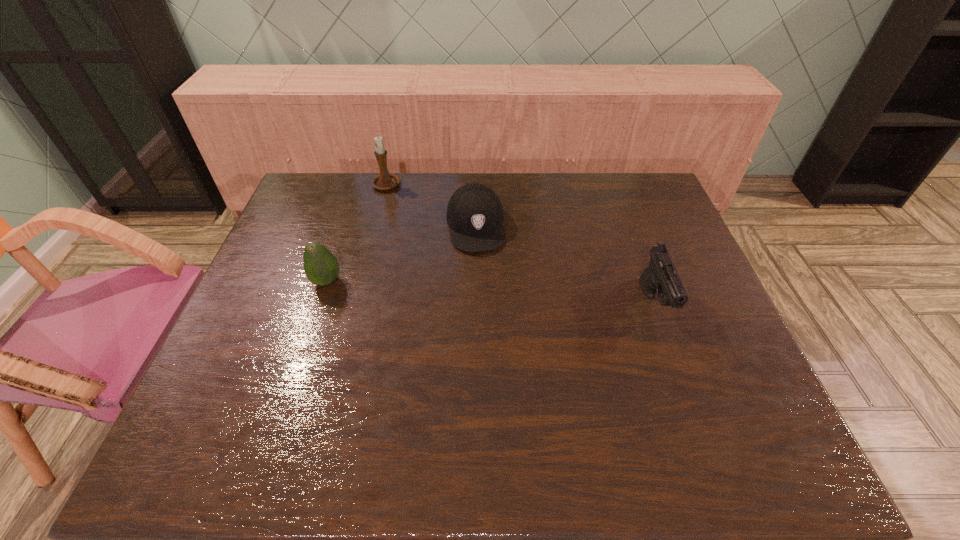
Locate an element on the screen. Image resolution: width=960 pixels, height=540 pixels. vacant space located on the front-facing side of the second object from right to left is located at coordinates (487, 314).

Identify the location of vacant point located 0.340m on the side of the candle holder with the handle. This screenshot has height=540, width=960. (431, 255).

Locate an element on the screen. vacant point located 0.250m on the side of the candle holder with the handle is located at coordinates (420, 238).

Image resolution: width=960 pixels, height=540 pixels. Find the location of `free point located on the side of the candle holder with the handle`. free point located on the side of the candle holder with the handle is located at coordinates (437, 264).

Find the location of `cap that is at the far edge`. cap that is at the far edge is located at coordinates (474, 214).

I want to click on candle holder that is at the far edge, so click(384, 181).

I want to click on object located at the left edge, so click(x=321, y=267).

Where is `object positioned at the right edge`? The height and width of the screenshot is (540, 960). object positioned at the right edge is located at coordinates (661, 277).

In the image, there is a desktop. Identify the location of vacant region at the far edge. This screenshot has width=960, height=540. pos(372,186).

At what (x,y) coordinates should I click in order to perform the action: click on blank space at the near edge. Please return your answer as a coordinate pair (x, y). Image resolution: width=960 pixels, height=540 pixels. Looking at the image, I should click on (563, 403).